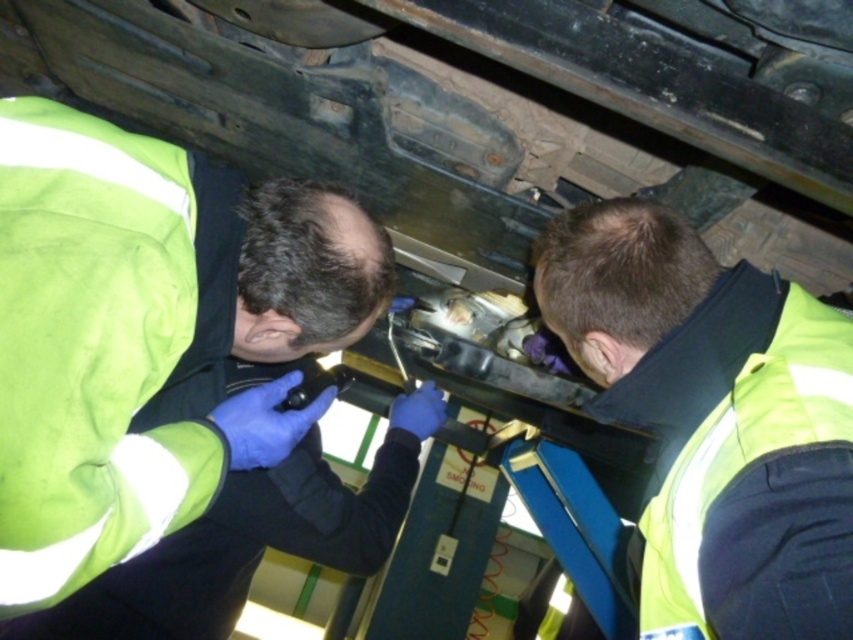
Who is lower down, green reflective vest at center or yellow reflective vest at lower right?

yellow reflective vest at lower right is lower down.

Can you confirm if green reflective vest at center is positioned above yellow reflective vest at lower right?

Correct, green reflective vest at center is located above yellow reflective vest at lower right.

Between point (107, 595) and point (798, 422), which one is positioned in front?

Point (798, 422) is in front.

Where is `green reflective vest at center`? This screenshot has height=640, width=853. green reflective vest at center is located at coordinates (148, 352).